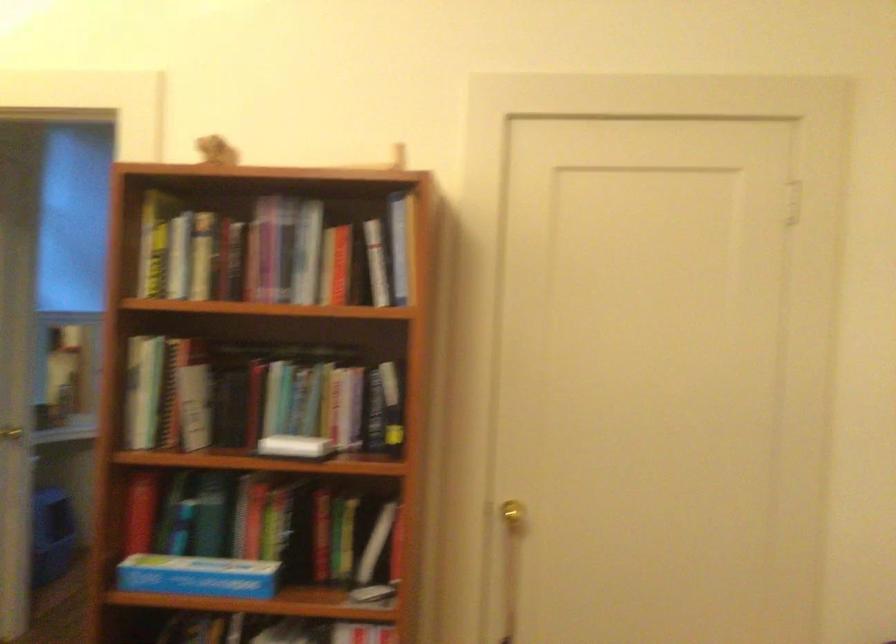
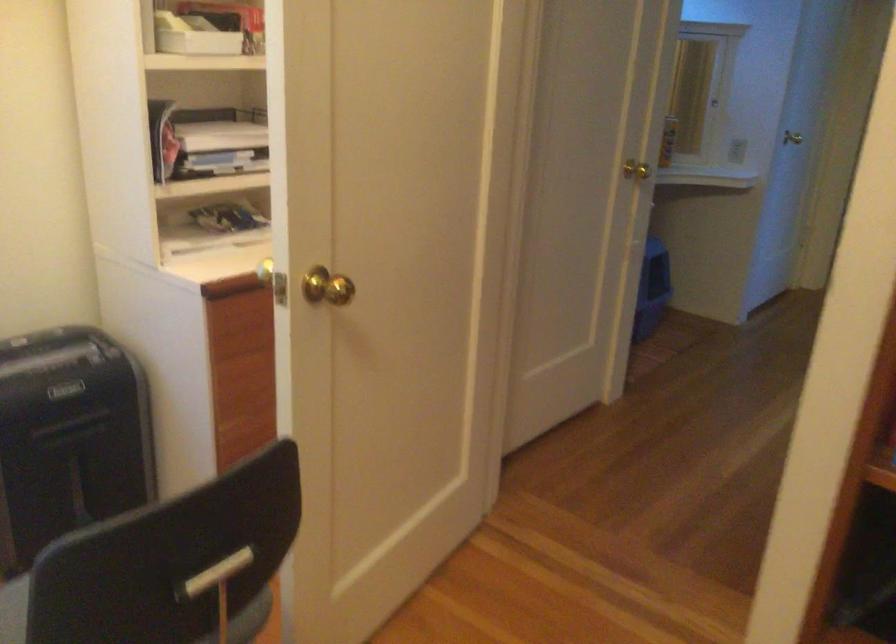
Looking at this image, how did the camera likely rotate?

The camera rotated toward left-down.